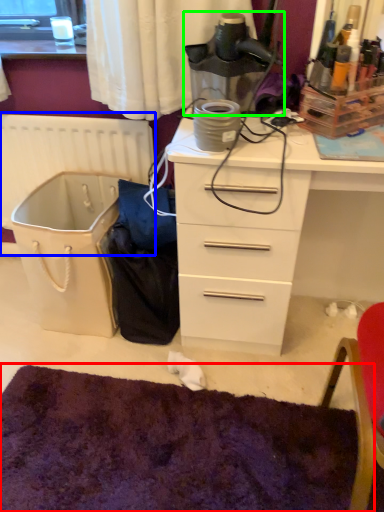
Question: Which is farther away from mat (highlighted by a red box)? radiator (highlighted by a blue box) or appliance (highlighted by a green box)?

Choices:
 (A) radiator
 (B) appliance

Answer: (B)